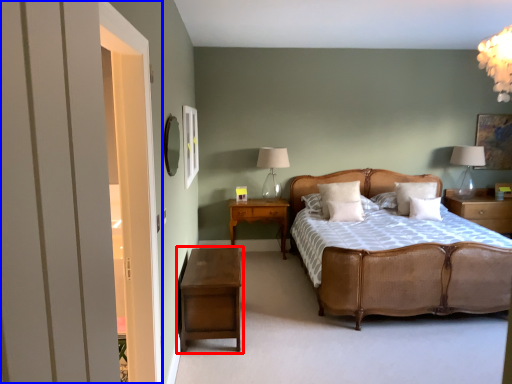
Question: Which of the following is the farthest to the observer, nightstand (highlighted by a red box) or door (highlighted by a blue box)?

Choices:
 (A) nightstand
 (B) door

Answer: (A)